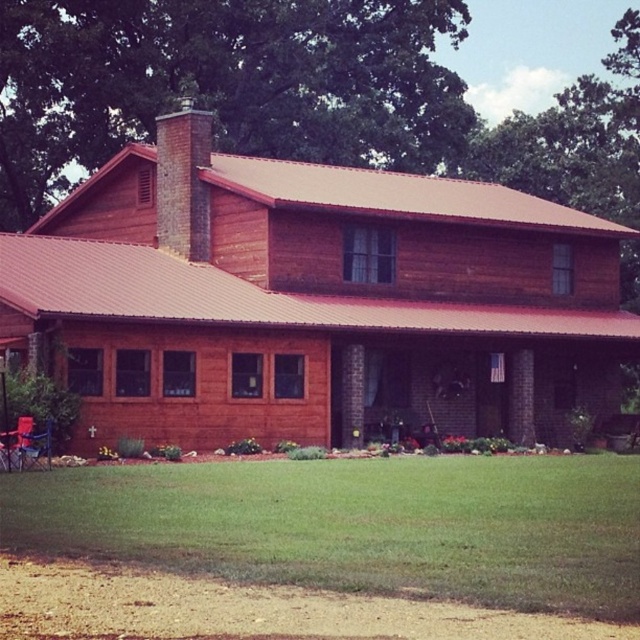
Consider the image. You are standing at the entrance of the house and want to place a new potted plant. The potted plant needs to be placed on the green grass at lower center. According to the image, where exactly should you place the potted plant?

The green grass at lower center is located at point (358, 524), so you should place the potted plant there.

You are standing at the entrance of the house and want to walk to a specific location. If you first walk towards point [36,518] and then continue moving forward, will you pass by point [486,196] before reaching the end of the lawn?

Point [486,196] is behind point [36,518], so if you walk towards point [36,518] first, you will not pass by point [486,196] before reaching the end of the lawn.